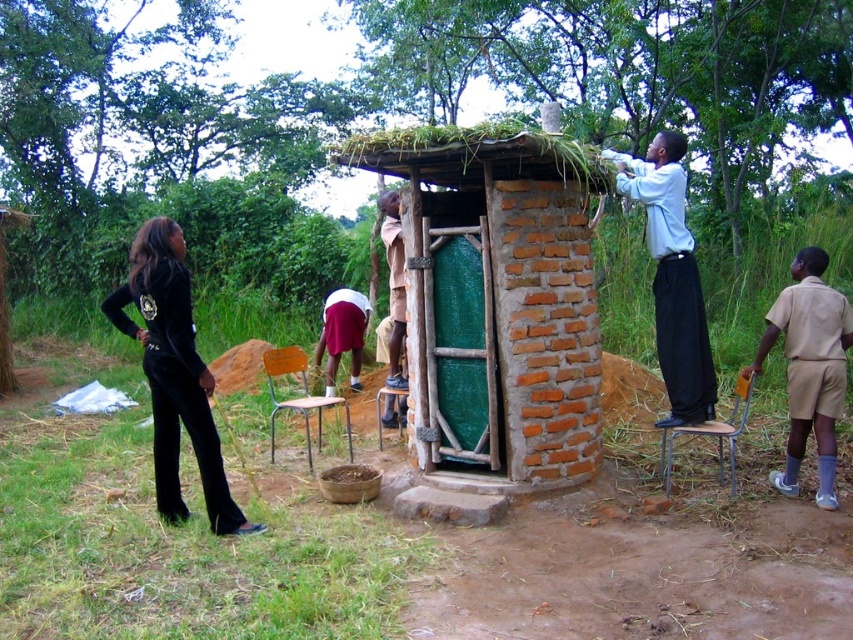
Is black velvet pants at left wider than light blue shirt at upper right?

Yes.

Which is behind, point (210, 417) or point (657, 346)?

Point (657, 346)

Describe the element at coordinates (173, 372) in the screenshot. I see `black velvet pants at left` at that location.

The image size is (853, 640). I want to click on black velvet pants at left, so click(x=173, y=372).

Between light blue shirt at upper right and beige uniform at right, which one appears on the left side from the viewer's perspective?

Positioned to the left is light blue shirt at upper right.

Who is more forward, (685, 394) or (833, 465)?

Point (833, 465)

Does point (686, 314) come closer to viewer compared to point (827, 410)?

That is False.

The image size is (853, 640). I want to click on light blue shirt at upper right, so click(x=672, y=276).

From the picture: Is black velvet pants at left taller than beige uniform at right?

Yes, black velvet pants at left is taller than beige uniform at right.

Is black velvet pants at left positioned at the back of beige uniform at right?

No, black velvet pants at left is closer to the viewer.

Who is more forward, (173, 499) or (822, 284)?

Point (173, 499) is in front.

What are the coordinates of `black velvet pants at left` in the screenshot? It's located at (173, 372).